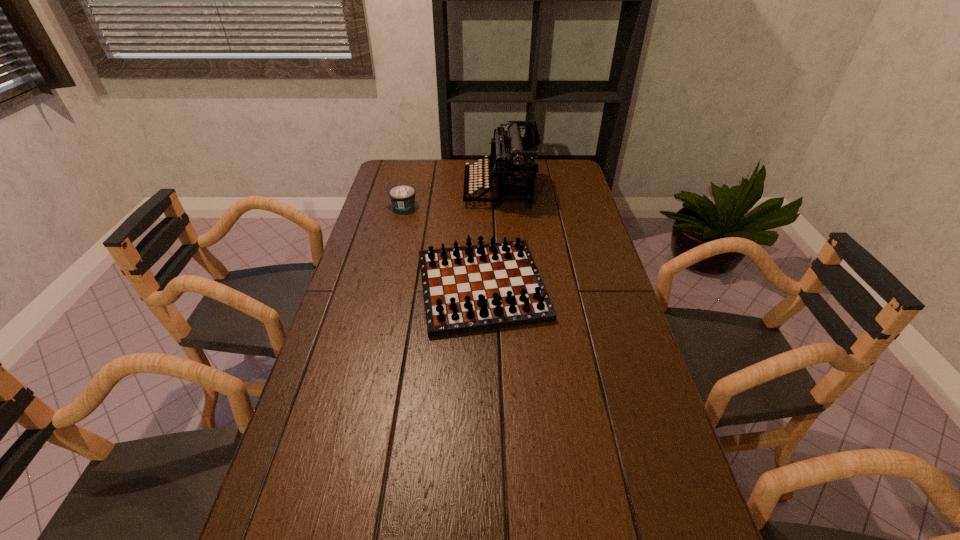
Where is `typewriter`? typewriter is located at coordinates (512, 162).

I want to click on the second tallest object, so click(481, 287).

You are a GUI agent. You are given a task and a screenshot of the screen. Output one action in this format:
    pyautogui.click(x=<x>, y=<y>)
    Task: Click on the nearest object
    
    Given the screenshot: What is the action you would take?
    pyautogui.click(x=481, y=287)

You are a GUI agent. You are given a task and a screenshot of the screen. Output one action in this format:
    pyautogui.click(x=<x>, y=<y>)
    Task: Click on the yogurt
    The height and width of the screenshot is (540, 960).
    Given the screenshot: What is the action you would take?
    pyautogui.click(x=402, y=197)

Where is `the leftmost object`? This screenshot has width=960, height=540. the leftmost object is located at coordinates (402, 197).

The image size is (960, 540). Find the location of `blank space located 0.240m on the typing side of the tallest object`. blank space located 0.240m on the typing side of the tallest object is located at coordinates (402, 191).

The width and height of the screenshot is (960, 540). What are the coordinates of `vacant space located 0.320m on the typing side of the tallest object` in the screenshot? It's located at (382, 191).

This screenshot has width=960, height=540. Find the location of `free region located 0.190m on the typing side of the tallest object`. free region located 0.190m on the typing side of the tallest object is located at coordinates (416, 191).

Identify the location of vacant region located 0.280m on the front of the second shortest object. (483, 437).

Locate an element on the screen. The width and height of the screenshot is (960, 540). free region located on the right of the yogurt is located at coordinates (517, 206).